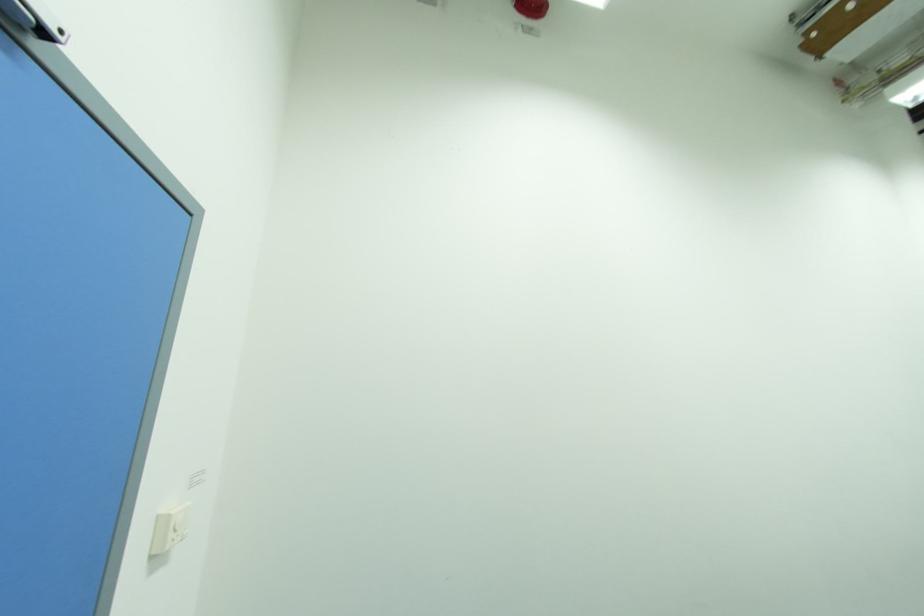
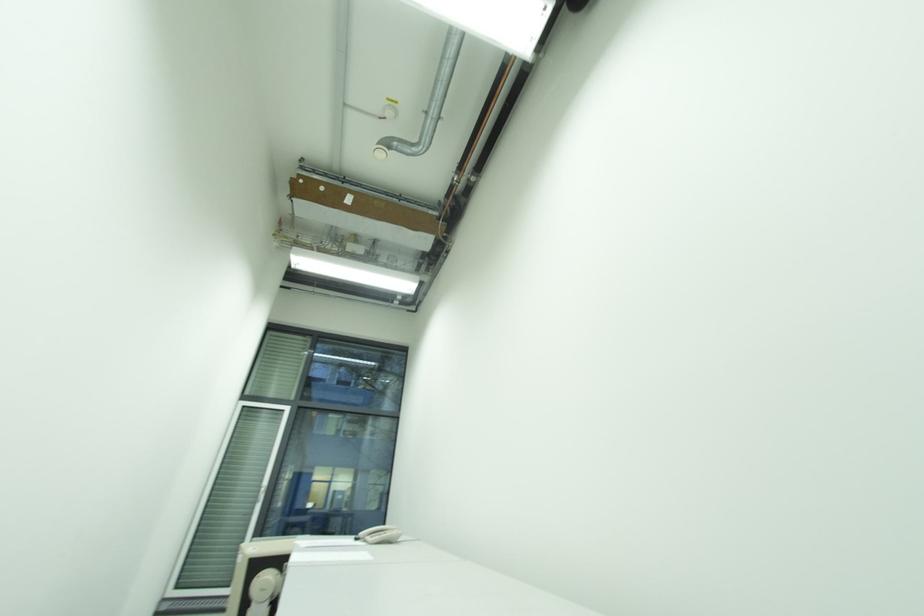
The first image is from the beginning of the video and the second image is from the end. How did the camera likely rotate when shooting the video?

The rotation direction of the camera is right-up.